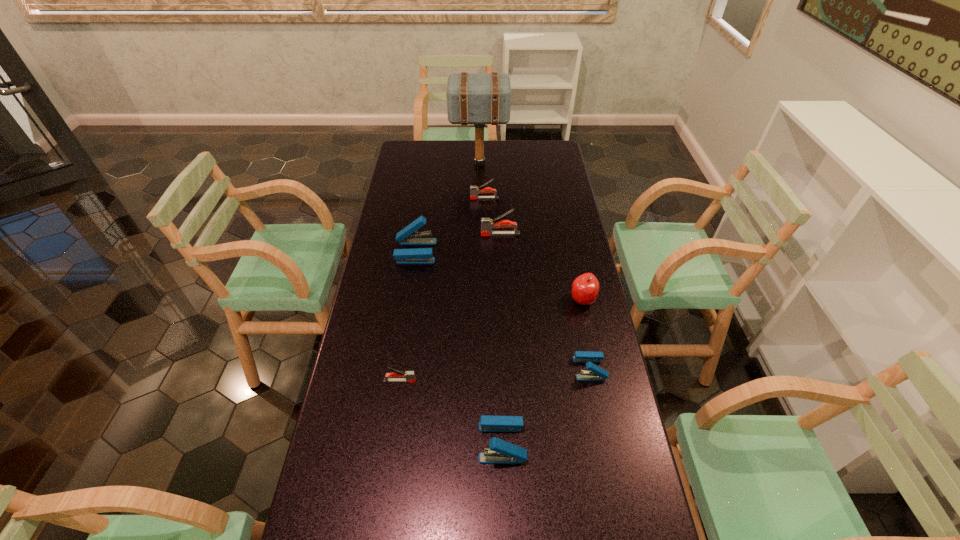
The width and height of the screenshot is (960, 540). Find the location of `the second smallest blue stapler`. the second smallest blue stapler is located at coordinates (500, 451).

The image size is (960, 540). I want to click on the second blue stapler from right to left, so click(x=500, y=451).

This screenshot has height=540, width=960. I want to click on the nearest gray stapler, so click(396, 376).

Identify the location of the leftmost gray stapler. Image resolution: width=960 pixels, height=540 pixels. (396, 376).

Where is `the rightmost blue stapler`? The image size is (960, 540). the rightmost blue stapler is located at coordinates (596, 373).

What are the coordinates of `the rightmost stapler` in the screenshot? It's located at (596, 373).

What are the coordinates of `vacant area located 0.170m on the striking surface of the farthest object` in the screenshot? It's located at click(x=543, y=164).

At what (x,y) coordinates should I click in order to perform the action: click on vacant area located on the handle side of the biggest gray stapler. Please return your answer as a coordinate pair (x, y). The width and height of the screenshot is (960, 540). Looking at the image, I should click on (463, 234).

The width and height of the screenshot is (960, 540). What are the coordinates of `vacant area situated 0.240m on the handle side of the biggest gray stapler` in the screenshot? It's located at (420, 234).

Where is `free location located on the handle side of the biggest gray stapler`? The height and width of the screenshot is (540, 960). free location located on the handle side of the biggest gray stapler is located at coordinates (437, 234).